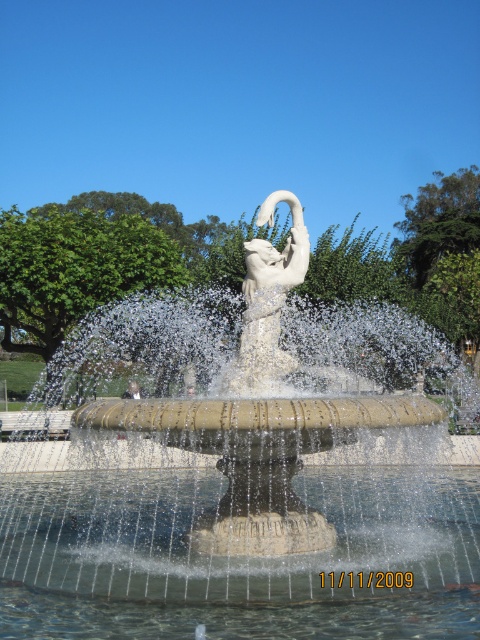
The image size is (480, 640). Describe the element at coordinates (239, 467) in the screenshot. I see `white stone fountain at center` at that location.

The image size is (480, 640). What do you see at coordinates (239, 467) in the screenshot?
I see `white stone fountain at center` at bounding box center [239, 467].

Locate an element on the screen. The height and width of the screenshot is (640, 480). white stone fountain at center is located at coordinates (239, 467).

Locate an element on the screen. The width and height of the screenshot is (480, 640). white stone fountain at center is located at coordinates point(239,467).

Does point (96, 586) lie in front of point (285, 291)?

Yes, point (96, 586) is closer to viewer.

Who is more distant from viewer, (343, 496) or (257, 260)?

Point (343, 496)

Identify the location of white stone fountain at center. (239, 467).

Which is behind, point (291, 627) or point (259, 257)?

The point (259, 257) is behind.

Where is `clear water at fountain center`? The height and width of the screenshot is (640, 480). clear water at fountain center is located at coordinates (237, 557).

Between point (84, 502) and point (227, 385), which one is positioned behind?

Point (84, 502)

Locate an element on the screen. The image size is (480, 640). clear water at fountain center is located at coordinates (237, 557).